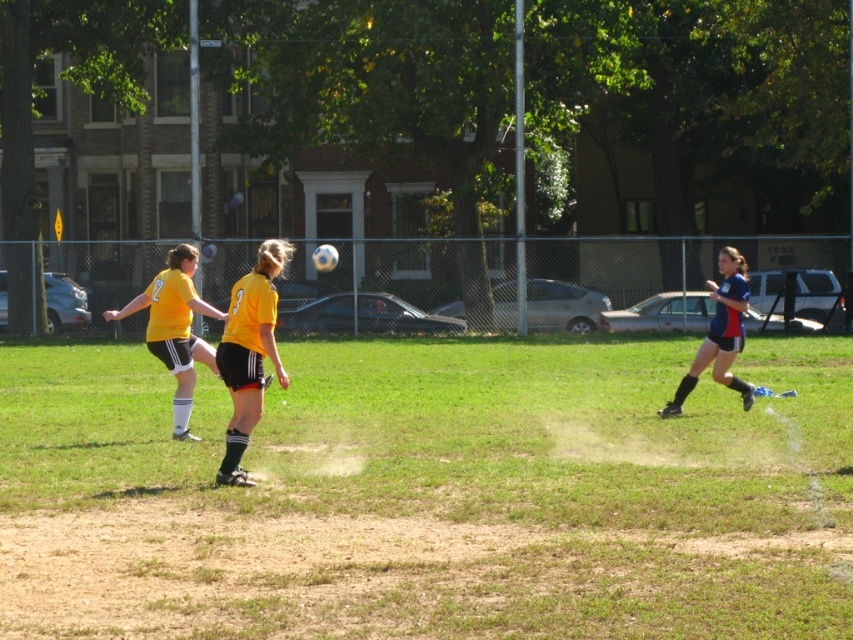
Question: Is yellow matte jersey at center to the right of blue fabric uniform at right from the viewer's perspective?

Choices:
 (A) no
 (B) yes

Answer: (A)

Question: Which point appears closest to the camera in this image?

Choices:
 (A) (440, 358)
 (B) (247, 339)

Answer: (B)

Question: Which object is positioned farthest from the yellow matte jersey at center?

Choices:
 (A) blue fabric uniform at right
 (B) green grass at center
 (C) yellow matte jersey at left

Answer: (A)

Question: Among these objects, which one is nearest to the camera?

Choices:
 (A) blue fabric uniform at right
 (B) yellow matte jersey at center
 (C) yellow matte jersey at left

Answer: (B)

Question: Can you confirm if green grass at center is wider than blue fabric uniform at right?

Choices:
 (A) yes
 (B) no

Answer: (A)

Question: Is green grass at center thinner than yellow matte jersey at left?

Choices:
 (A) yes
 (B) no

Answer: (B)